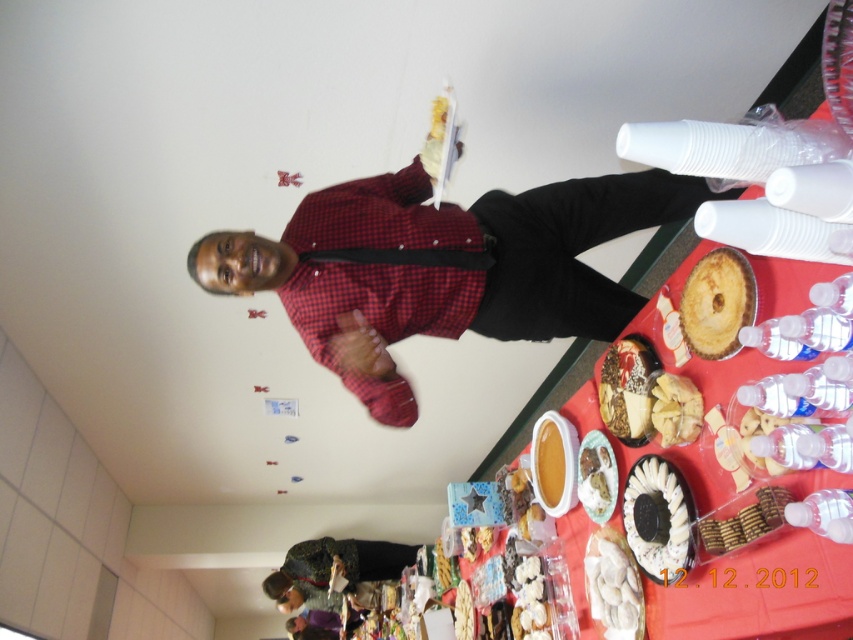
You are a photographer at a social event and need to capture a closeup of the red checkered shirt at center and the white crumbly cake at center. Your camera has a maximum focus range of 24 inches. Can you fit both subjects in the frame without moving the camera?

The red checkered shirt at center and white crumbly cake at center are 24.69 inches apart from each other. Since the distance between them exceeds the camera maximum focus range of 24 inches, you cannot fit both subjects in the frame without moving the camera.

In the scene shown: You are planning to serve desserts at a party and need to know which cake takes up more space on the table. Which cake has a greater width between the shiny chocolate cake at center and the white creamy cake at center?

The shiny chocolate cake at center has a greater width than the white creamy cake at center according to the description.

You are at a party and want to place a 12 inch long decorative ribbon between the shiny chocolate cake at center and the smooth brown cookies at lower right. Will the ribbon fit between them?

The shiny chocolate cake at center is 16.82 inches from the smooth brown cookies at lower right. Since the ribbon is 12 inches long, it will fit between them with some space to spare.